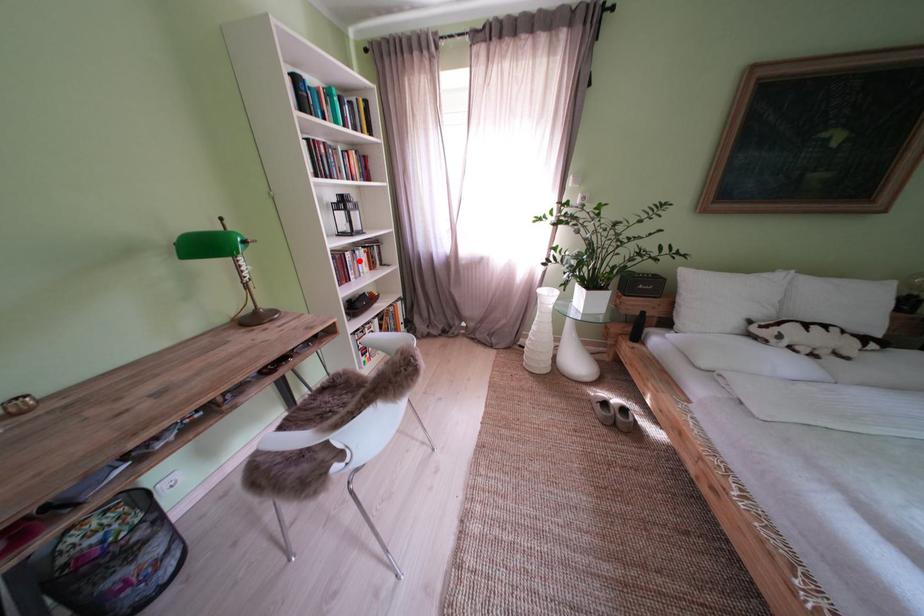
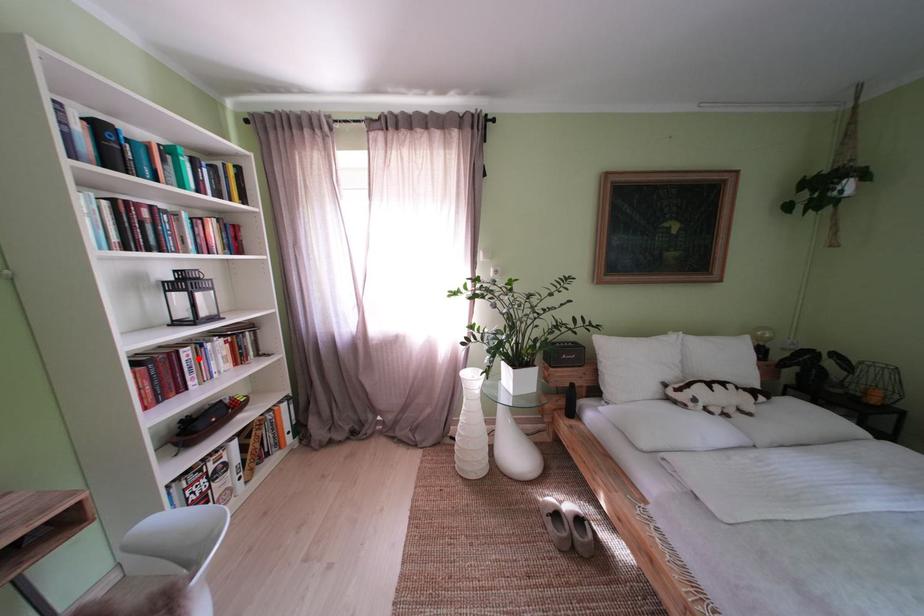
I am providing you with two images of the same scene from different viewpoints. A red point is marked on the first image and another point is marked on the second image. Is the marked point in image1 the same physical position as the marked point in image2?

Yes